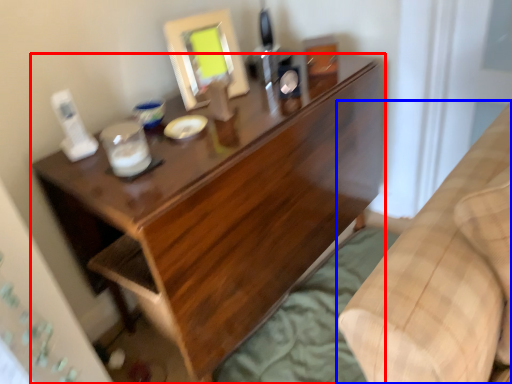
Question: Which point is closer to the camera, desk (highlighted by a red box) or furniture (highlighted by a blue box)?

Choices:
 (A) desk
 (B) furniture

Answer: (B)